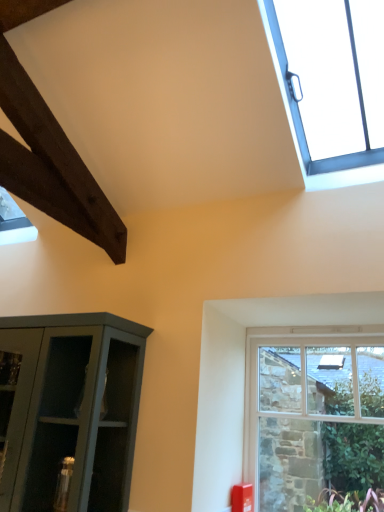
Question: Is clear glass window at lower right, the second window from the top, spatially inside clear glass window at upper right, marked as the 1th window in a top-to-bottom arrangement, or outside of it?

Choices:
 (A) inside
 (B) outside

Answer: (B)

Question: In the image, is clear glass window at lower right, the second window from the top, positioned in front of or behind clear glass window at upper right, marked as the 1th window in a top-to-bottom arrangement?

Choices:
 (A) behind
 (B) front

Answer: (A)

Question: From a real-world perspective, is clear glass window at lower right, placed as the first window when sorted from bottom to top, positioned above or below clear glass window at upper right, which is the second window from bottom to top?

Choices:
 (A) above
 (B) below

Answer: (B)

Question: From the image's perspective, is clear glass window at upper right, which is the second window from bottom to top, above or below clear glass window at lower right, the second window from the top?

Choices:
 (A) below
 (B) above

Answer: (B)

Question: Considering the positions of clear glass window at upper right, which is the second window from bottom to top, and clear glass window at lower right, placed as the first window when sorted from bottom to top, in the image, is clear glass window at upper right, which is the second window from bottom to top, bigger or smaller than clear glass window at lower right, placed as the first window when sorted from bottom to top,?

Choices:
 (A) small
 (B) big

Answer: (B)

Question: From a real-world perspective, is clear glass window at upper right, which is the second window from bottom to top, physically located above or below clear glass window at lower right, the second window from the top?

Choices:
 (A) below
 (B) above

Answer: (B)

Question: Considering the positions of clear glass window at upper right, marked as the 1th window in a top-to-bottom arrangement, and clear glass window at lower right, placed as the first window when sorted from bottom to top, in the image, is clear glass window at upper right, marked as the 1th window in a top-to-bottom arrangement, taller or shorter than clear glass window at lower right, placed as the first window when sorted from bottom to top,?

Choices:
 (A) short
 (B) tall

Answer: (A)